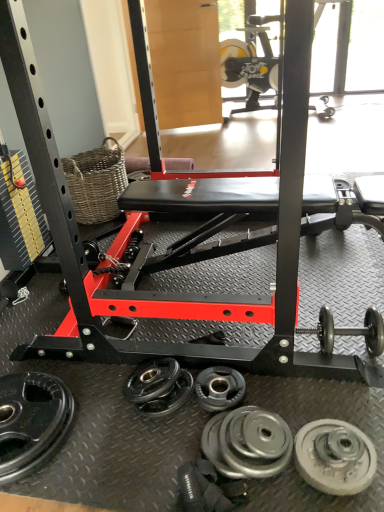
Locate an element on the screen. vacant space situated above silver metallic weight plate at lower center, which ranks as the third wheel in left-to-right order (from a real-world perspective) is located at coordinates (255, 444).